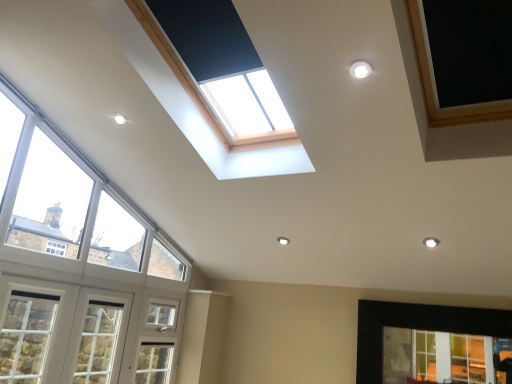
Question: From the image's perspective, is white painted wood window at lower left, placed as the fourth window when sorted from right to left, above or below clear glass window at left, which is the 2th window from right to left?

Choices:
 (A) above
 (B) below

Answer: (B)

Question: In terms of size, does white painted wood window at lower left, positioned as the 1th window in left-to-right order, appear bigger or smaller than clear glass window at left, which is the 2th window from right to left?

Choices:
 (A) small
 (B) big

Answer: (A)

Question: Estimate the real-world distances between objects in this image. Which object is closer to the clear glass window at lower right, the 1th window positioned from the right?

Choices:
 (A) white wood window at lower left, arranged as the 2th window when viewed from the left
 (B) white textured screen door at lower left
 (C) white painted wood window at lower left, positioned as the 1th window in left-to-right order
 (D) clear glass window at left, which is the 2th window from right to left

Answer: (B)

Question: Estimate the real-world distances between objects in this image. Which object is closer to the clear glass window at left, placed as the third window when sorted from left to right?

Choices:
 (A) white wood window at lower left, arranged as the 2th window when viewed from the left
 (B) white textured screen door at lower left
 (C) white painted wood window at lower left, positioned as the 1th window in left-to-right order
 (D) clear glass window at lower right, which is the fourth window from left to right

Answer: (A)